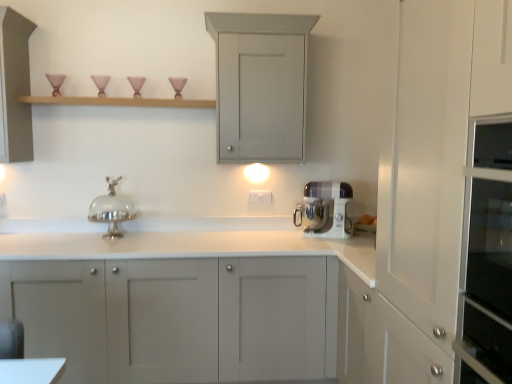
This screenshot has width=512, height=384. Find the location of `matte gray cabinet at left, which appears as the 2th cabinetry when viewed from the top`. matte gray cabinet at left, which appears as the 2th cabinetry when viewed from the top is located at coordinates (15, 86).

The width and height of the screenshot is (512, 384). Identify the location of white plastic stand mixer at center. (325, 210).

What do you see at coordinates (260, 84) in the screenshot?
I see `matte gray cabinet at upper center, which is counted as the 1th cabinetry, starting from the top` at bounding box center [260, 84].

Measure the distance between wooden shelf at upper center and camera.

The depth of wooden shelf at upper center is 2.52 meters.

What do you see at coordinates (180, 304) in the screenshot? The height and width of the screenshot is (384, 512). I see `matte gray cabinet at center, the third cabinetry viewed from the top` at bounding box center [180, 304].

Locate an element on the screen. The image size is (512, 384). matte gray cabinet at left, which appears as the 2th cabinetry when viewed from the top is located at coordinates (15, 86).

Is matte gray cabinet at center, marked as the first cabinetry in a bottom-to-top arrangement, not close to matte gray cabinet at upper center, positioned as the third cabinetry in bottom-to-top order?

Indeed, matte gray cabinet at center, marked as the first cabinetry in a bottom-to-top arrangement, is not near matte gray cabinet at upper center, positioned as the third cabinetry in bottom-to-top order.

Does point (73, 353) come farther from viewer compared to point (219, 52)?

No, (73, 353) is closer to viewer.

Between matte gray cabinet at center, the third cabinetry viewed from the top, and matte gray cabinet at upper center, positioned as the third cabinetry in bottom-to-top order, which one has larger width?

Wider between the two is matte gray cabinet at center, the third cabinetry viewed from the top.

You are a GUI agent. You are given a task and a screenshot of the screen. Output one action in this format:
    pyautogui.click(x=<x>, y=<y>)
    Task: Click on the cabinetry that is the 1st one when counting leftward from the matte gray cabinet at upper center, which is counted as the 1th cabinetry, starting from the top
    
    Given the screenshot: What is the action you would take?
    pyautogui.click(x=180, y=304)

At what (x,y) coordinates should I click in order to perform the action: click on cabinetry that is the 2nd object to the left of the matte gray cabinet at upper center, positioned as the third cabinetry in bottom-to-top order, starting at the anchor. Please return your answer as a coordinate pair (x, y). This screenshot has height=384, width=512. Looking at the image, I should click on (15, 86).

From a real-world perspective, which object stands above the other?

matte gray cabinet at left, the 2th cabinetry ordered from the bottom, is physically above.

Which point is more forward, (279,58) or (23,72)?

The point (279,58) is closer.

From the picture: Is matte gray cabinet at center, the third cabinetry viewed from the top, inside the boundaries of white plastic stand mixer at center, or outside?

matte gray cabinet at center, the third cabinetry viewed from the top, is located beyond the bounds of white plastic stand mixer at center.

Is matte gray cabinet at center, the third cabinetry viewed from the top, directly adjacent to white plastic stand mixer at center?

There is a gap between matte gray cabinet at center, the third cabinetry viewed from the top, and white plastic stand mixer at center.

Does matte gray cabinet at center, the third cabinetry viewed from the top, have a larger size compared to white plastic stand mixer at center?

Yes, matte gray cabinet at center, the third cabinetry viewed from the top, is bigger than white plastic stand mixer at center.

What's the angular difference between matte gray cabinet at center, marked as the first cabinetry in a bottom-to-top arrangement, and white plastic stand mixer at center's facing directions?

The angle between the facing direction of matte gray cabinet at center, marked as the first cabinetry in a bottom-to-top arrangement, and the facing direction of white plastic stand mixer at center is 21.1 degrees.

Can you confirm if silver metallic cake stand at center is taller than white plastic stand mixer at center?

Correct, silver metallic cake stand at center is much taller as white plastic stand mixer at center.

Who is more distant, silver metallic cake stand at center or white plastic stand mixer at center?

white plastic stand mixer at center is behind.

Between point (113, 222) and point (350, 222), which one is positioned in front?

The point (113, 222) is more forward.

Considering the sizes of objects silver metallic cake stand at center and white plastic stand mixer at center in the image provided, who is wider, silver metallic cake stand at center or white plastic stand mixer at center?

silver metallic cake stand at center is wider.

Which object is further away from the camera taking this photo, silver metallic cake stand at center or matte gray cabinet at upper center, positioned as the third cabinetry in bottom-to-top order?

silver metallic cake stand at center is more distant.

Looking at this image, which object is wider, silver metallic cake stand at center or matte gray cabinet at upper center, which is counted as the 1th cabinetry, starting from the top?

matte gray cabinet at upper center, which is counted as the 1th cabinetry, starting from the top.

Is silver metallic cake stand at center to the left of matte gray cabinet at upper center, which is counted as the 1th cabinetry, starting from the top, from the viewer's perspective?

Yes.

From a real-world perspective, starting from the silver metallic cake stand at center, which cabinetry is the 1st one vertically above it? Please provide its 2D coordinates.

[(260, 84)]

Is wooden shelf at upper center in front of matte gray cabinet at upper center, which is counted as the 1th cabinetry, starting from the top?

No, wooden shelf at upper center is further to the viewer.

Would you consider wooden shelf at upper center to be distant from matte gray cabinet at upper center, positioned as the third cabinetry in bottom-to-top order?

No, wooden shelf at upper center is in close proximity to matte gray cabinet at upper center, positioned as the third cabinetry in bottom-to-top order.

From a real-world perspective, is wooden shelf at upper center positioned above or below matte gray cabinet at upper center, which is counted as the 1th cabinetry, starting from the top?

wooden shelf at upper center is situated lower than matte gray cabinet at upper center, which is counted as the 1th cabinetry, starting from the top, in the real world.

Is wooden shelf at upper center taller than matte gray cabinet at upper center, which is counted as the 1th cabinetry, starting from the top?

In fact, wooden shelf at upper center may be shorter than matte gray cabinet at upper center, which is counted as the 1th cabinetry, starting from the top.

From the image's perspective, who appears lower, silver metallic cake stand at center or matte gray cabinet at left, the 2th cabinetry ordered from the bottom?

From the image's view, silver metallic cake stand at center is below.

Considering the points (110, 208) and (4, 62), which point is behind, point (110, 208) or point (4, 62)?

The point (110, 208) is more distant.

Measure the distance between silver metallic cake stand at center and matte gray cabinet at left, the 2th cabinetry ordered from the bottom.

silver metallic cake stand at center and matte gray cabinet at left, the 2th cabinetry ordered from the bottom, are 28.60 inches apart from each other.

Is silver metallic cake stand at center looking in the opposite direction of matte gray cabinet at left, the 2th cabinetry ordered from the bottom?

No.

Locate an element on the screen. cabinetry that is on the right side of matte gray cabinet at center, the third cabinetry viewed from the top is located at coordinates (260, 84).

This screenshot has height=384, width=512. I want to click on cabinetry that is behind the matte gray cabinet at left, which appears as the 2th cabinetry when viewed from the top, so click(260, 84).

When comparing their distances from matte gray cabinet at center, marked as the first cabinetry in a bottom-to-top arrangement, does matte gray cabinet at upper center, which is counted as the 1th cabinetry, starting from the top, or wooden shelf at upper center seem closer?

matte gray cabinet at upper center, which is counted as the 1th cabinetry, starting from the top, lies closer to matte gray cabinet at center, marked as the first cabinetry in a bottom-to-top arrangement, than the other object.

Which object lies further to the anchor point matte gray cabinet at center, the third cabinetry viewed from the top, wooden shelf at upper center or matte gray cabinet at left, the 2th cabinetry ordered from the bottom?

wooden shelf at upper center is further to matte gray cabinet at center, the third cabinetry viewed from the top.

From the image, which object appears to be farther from matte gray cabinet at center, marked as the first cabinetry in a bottom-to-top arrangement, matte gray cabinet at left, which appears as the 2th cabinetry when viewed from the top, or white plastic stand mixer at center?

Among the two, matte gray cabinet at left, which appears as the 2th cabinetry when viewed from the top, is located further to matte gray cabinet at center, marked as the first cabinetry in a bottom-to-top arrangement.

Based on their spatial positions, is matte gray cabinet at left, which appears as the 2th cabinetry when viewed from the top, or matte gray cabinet at upper center, which is counted as the 1th cabinetry, starting from the top, closer to wooden shelf at upper center?

matte gray cabinet at left, which appears as the 2th cabinetry when viewed from the top.

Estimate the real-world distances between objects in this image. Which object is closer to matte gray cabinet at upper center, which is counted as the 1th cabinetry, starting from the top, wooden shelf at upper center or silver metallic cake stand at center?

The object closer to matte gray cabinet at upper center, which is counted as the 1th cabinetry, starting from the top, is wooden shelf at upper center.

Based on their spatial positions, is silver metallic cake stand at center or wooden shelf at upper center closer to matte gray cabinet at upper center, positioned as the third cabinetry in bottom-to-top order?

Among the two, wooden shelf at upper center is located nearer to matte gray cabinet at upper center, positioned as the third cabinetry in bottom-to-top order.

In the scene shown: Looking at the image, which one is located further to matte gray cabinet at upper center, positioned as the third cabinetry in bottom-to-top order, matte gray cabinet at left, which appears as the 2th cabinetry when viewed from the top, or wooden shelf at upper center?

matte gray cabinet at left, which appears as the 2th cabinetry when viewed from the top, is further to matte gray cabinet at upper center, positioned as the third cabinetry in bottom-to-top order.

Estimate the real-world distances between objects in this image. Which object is further from silver metallic cake stand at center, matte gray cabinet at upper center, positioned as the third cabinetry in bottom-to-top order, or matte gray cabinet at center, marked as the first cabinetry in a bottom-to-top arrangement?

matte gray cabinet at upper center, positioned as the third cabinetry in bottom-to-top order.

The height and width of the screenshot is (384, 512). Find the location of `shelf that lies between matte gray cabinet at upper center, positioned as the third cabinetry in bottom-to-top order, and matte gray cabinet at center, the third cabinetry viewed from the top, from top to bottom`. shelf that lies between matte gray cabinet at upper center, positioned as the third cabinetry in bottom-to-top order, and matte gray cabinet at center, the third cabinetry viewed from the top, from top to bottom is located at coordinates (118, 102).

Find the location of a particular element. The width and height of the screenshot is (512, 384). faucet situated between matte gray cabinet at left, the 2th cabinetry ordered from the bottom, and white plastic stand mixer at center from left to right is located at coordinates (112, 209).

Identify the location of faucet between matte gray cabinet at left, which appears as the 2th cabinetry when viewed from the top, and matte gray cabinet at center, marked as the first cabinetry in a bottom-to-top arrangement, in the up-down direction. (112, 209).

Where is `faucet between wooden shelf at upper center and matte gray cabinet at center, marked as the first cabinetry in a bottom-to-top arrangement, in the up-down direction`? Image resolution: width=512 pixels, height=384 pixels. faucet between wooden shelf at upper center and matte gray cabinet at center, marked as the first cabinetry in a bottom-to-top arrangement, in the up-down direction is located at coordinates (112, 209).